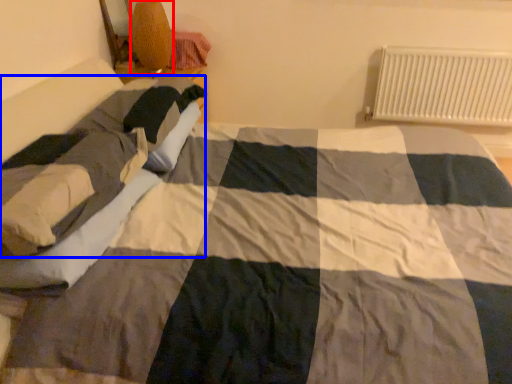
Question: Which of the following is the farthest to the observer, lamp (highlighted by a red box) or person (highlighted by a blue box)?

Choices:
 (A) lamp
 (B) person

Answer: (A)